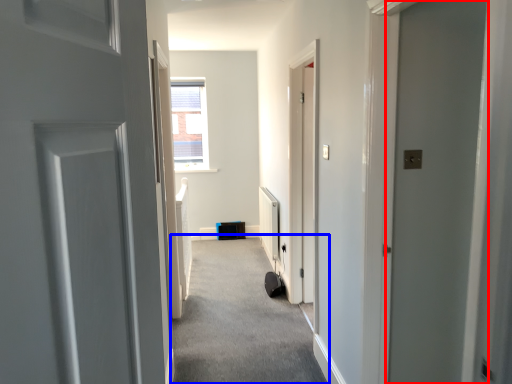
Question: Which point is closer to the camera, door (highlighted by a red box) or corridor (highlighted by a blue box)?

Choices:
 (A) door
 (B) corridor

Answer: (A)